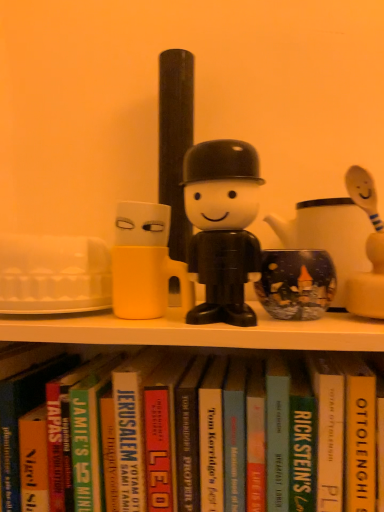
Question: Which direction should I rotate to look at hardcover book at center, the 1th paperback book positioned from the left?

Choices:
 (A) right
 (B) left

Answer: (B)

Question: Is hardcover book at center, which is counted as the fourth paperback book, starting from the right, far away from yellow hardcover book at center, arranged as the 1th paperback book when viewed from the right?

Choices:
 (A) no
 (B) yes

Answer: (A)

Question: Considering the relative sizes of hardcover book at center, positioned as the third paperback book in left-to-right order, and yellow hardcover book at center, marked as the sixth paperback book in a left-to-right arrangement, in the image provided, is hardcover book at center, positioned as the third paperback book in left-to-right order, taller than yellow hardcover book at center, marked as the sixth paperback book in a left-to-right arrangement,?

Choices:
 (A) no
 (B) yes

Answer: (A)

Question: From the image's perspective, is hardcover book at center, positioned as the third paperback book in left-to-right order, above yellow hardcover book at center, arranged as the 1th paperback book when viewed from the right?

Choices:
 (A) no
 (B) yes

Answer: (A)

Question: Is hardcover book at center, positioned as the third paperback book in left-to-right order, not inside yellow hardcover book at center, marked as the sixth paperback book in a left-to-right arrangement?

Choices:
 (A) yes
 (B) no

Answer: (A)

Question: From the image's perspective, would you say hardcover book at center, positioned as the third paperback book in left-to-right order, is shown under yellow hardcover book at center, arranged as the 1th paperback book when viewed from the right?

Choices:
 (A) no
 (B) yes

Answer: (B)

Question: Is hardcover book at center, which is counted as the fourth paperback book, starting from the right, wider than yellow hardcover book at center, marked as the sixth paperback book in a left-to-right arrangement?

Choices:
 (A) yes
 (B) no

Answer: (A)

Question: Can you confirm if hardcover book at center, positioned as the third paperback book in left-to-right order, is smaller than hardcover book at center, the fifth paperback book when ordered from right to left?

Choices:
 (A) no
 (B) yes

Answer: (B)

Question: Considering the relative sizes of hardcover book at center, which is counted as the fourth paperback book, starting from the right, and hardcover book at center, arranged as the second paperback book when viewed from the left, in the image provided, is hardcover book at center, which is counted as the fourth paperback book, starting from the right, shorter than hardcover book at center, arranged as the second paperback book when viewed from the left,?

Choices:
 (A) yes
 (B) no

Answer: (A)

Question: Does hardcover book at center, positioned as the third paperback book in left-to-right order, come behind hardcover book at center, the fifth paperback book when ordered from right to left?

Choices:
 (A) no
 (B) yes

Answer: (B)

Question: From the image's perspective, is hardcover book at center, which is counted as the fourth paperback book, starting from the right, over hardcover book at center, the fifth paperback book when ordered from right to left?

Choices:
 (A) yes
 (B) no

Answer: (B)

Question: From a real-world perspective, is hardcover book at center, which is counted as the fourth paperback book, starting from the right, located beneath hardcover book at center, arranged as the second paperback book when viewed from the left?

Choices:
 (A) no
 (B) yes

Answer: (B)

Question: Can you confirm if hardcover book at center, which is counted as the fourth paperback book, starting from the right, is taller than hardcover book at center, arranged as the second paperback book when viewed from the left?

Choices:
 (A) yes
 (B) no

Answer: (B)

Question: From the image's perspective, is hardcover book at center, the 1th paperback book positioned from the left, on top of black plastic figure at center?

Choices:
 (A) no
 (B) yes

Answer: (A)